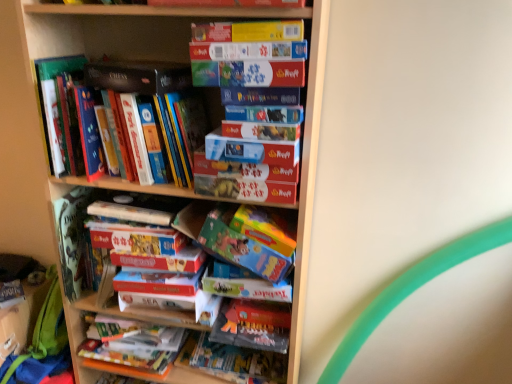
Question: Would you say matte cardboard book at center, which is the fifth paperback book in bottom-to-top order, is to the left or to the right of matte cardboard book at upper center, the second paperback book from the top, in the picture?

Choices:
 (A) left
 (B) right

Answer: (A)

Question: From the image's perspective, is matte cardboard book at center, which ranks as the fourth paperback book in top-to-bottom order, positioned above or below matte cardboard book at upper center, the second paperback book from the top?

Choices:
 (A) below
 (B) above

Answer: (A)

Question: Which object is positioned farthest from the green fabric backpack at lower left?

Choices:
 (A) hardcover book at center, which is the 1th paperback book from bottom to top
 (B) matte cardboard book at center, the 3th paperback book when ordered from bottom to top
 (C) hardcover book at upper left, the 1th book from the top
 (D) matte cardboard book at center, the 2th book positioned from the top
 (E) matte cardboard book at center, which ranks as the fourth paperback book in top-to-bottom order

Answer: (E)

Question: Which of these objects is positioned closest to the hardcover book at center, which is counted as the 8th paperback book, starting from the top?

Choices:
 (A) matte cardboard book at center, the 3th paperback book when ordered from bottom to top
 (B) yellow cardboard book at upper center, the first paperback book from the top
 (C) blue cardboard book at center, which ranks as the second paperback book in bottom-to-top order
 (D) matte black book at upper left, the third paperback book in the top-to-bottom sequence
 (E) matte cardboard book at upper center, the second paperback book from the top

Answer: (C)